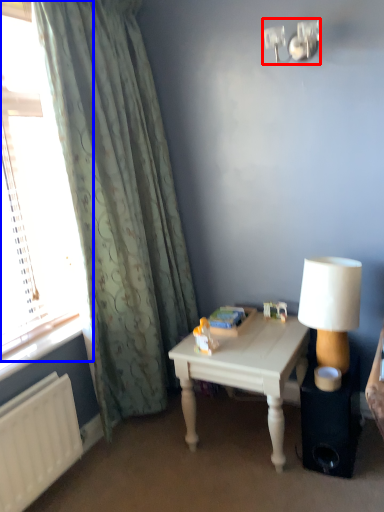
Question: Which of the following is the closest to the observer, fixture (highlighted by a red box) or window (highlighted by a blue box)?

Choices:
 (A) fixture
 (B) window

Answer: (B)